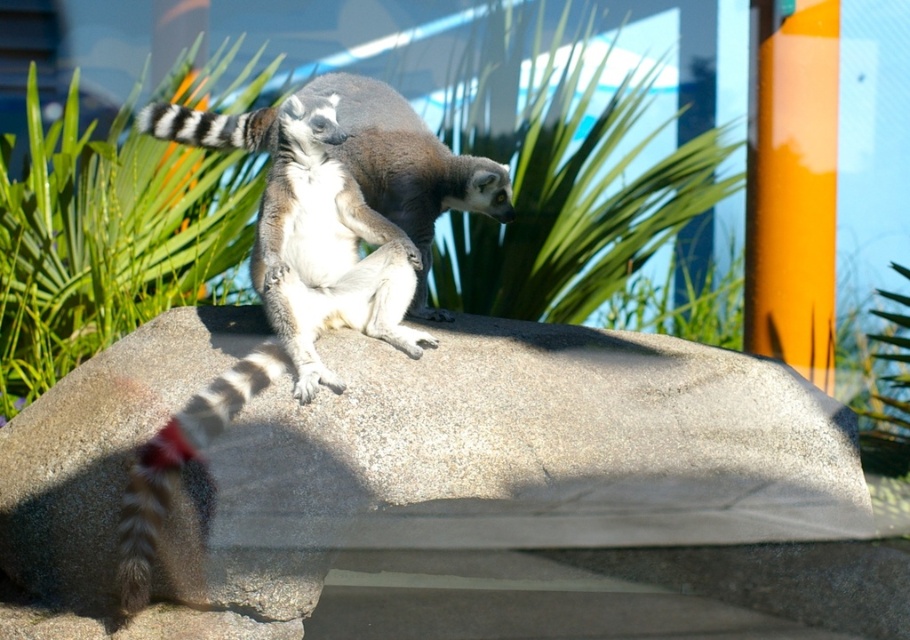
Consider the image. You are a wildlife photographer aiming to capture a photo of the gray granite boulder at center and the black and white striped tail at upper left. Based on their positions, which object should you focus on first to ensure both are in the frame?

The gray granite boulder at center is below the black and white striped tail at upper left, so you should focus on the black and white striped tail at upper left first to ensure both are in the frame.

You are a wildlife photographer aiming to capture the lemurs on the gray granite boulder at center. To ensure the boulder is clearly visible in your photo, where should you position your camera relative to the lemurs?

The gray granite boulder at center is located at point (507, 460), so you should position your camera to focus on that coordinate to ensure the boulder is clearly visible in the photo.